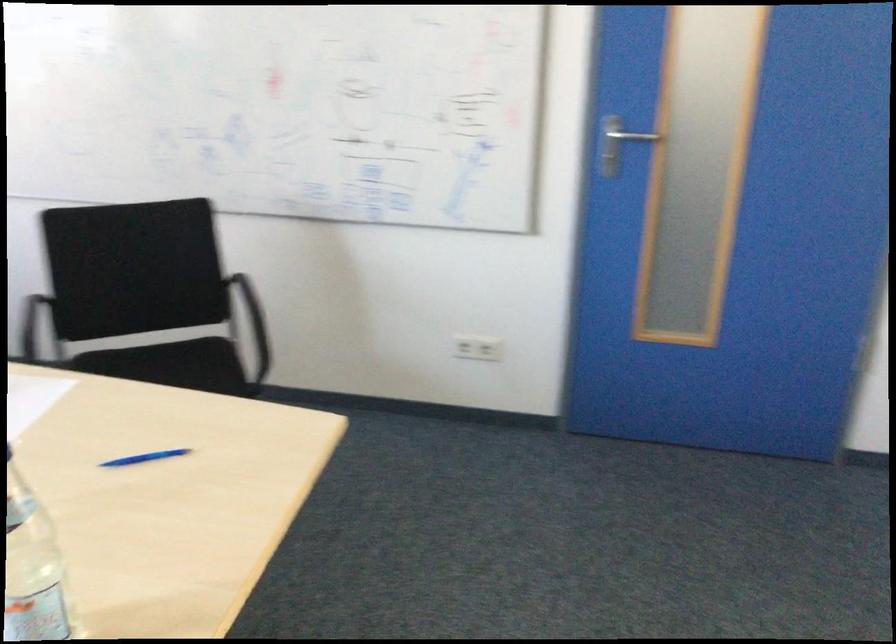
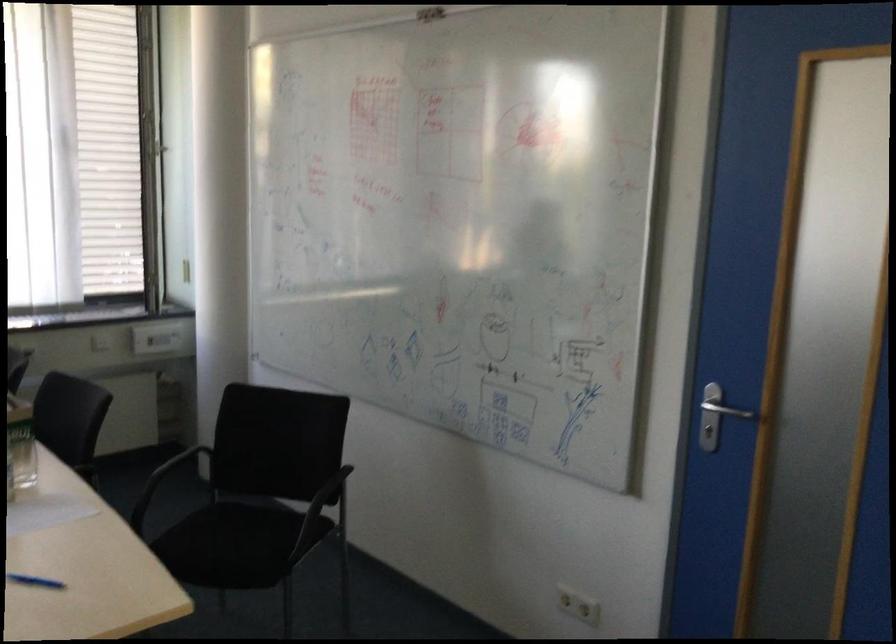
Find the pixel in the second image that matches point 119,453 in the first image.

(35, 581)